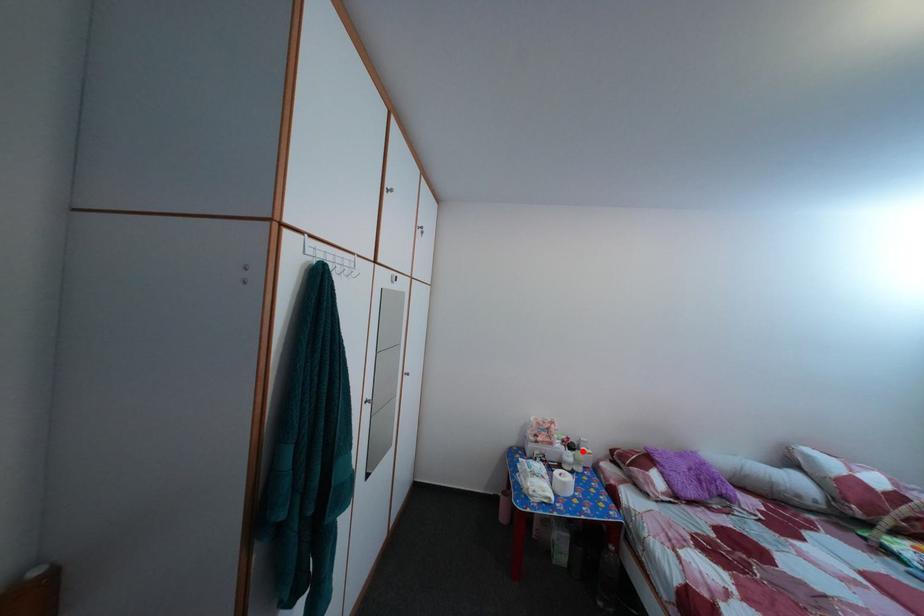
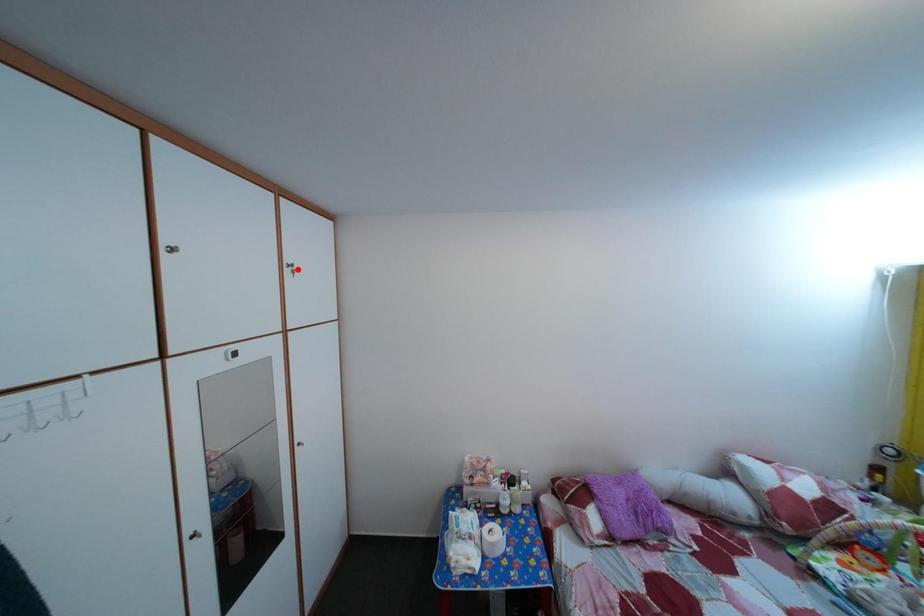
I am providing you with two images of the same scene from different viewpoints. A red point is marked on the first image and another point is marked on the second image. Are the points marked in image1 and image2 representing the same 3D position?

No